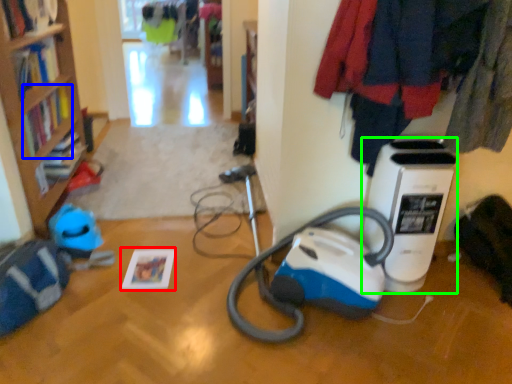
Question: Considering the real-world distances, which object is closest to book (highlighted by a red box)? book (highlighted by a blue box) or home appliance (highlighted by a green box).

Choices:
 (A) book
 (B) home appliance

Answer: (A)